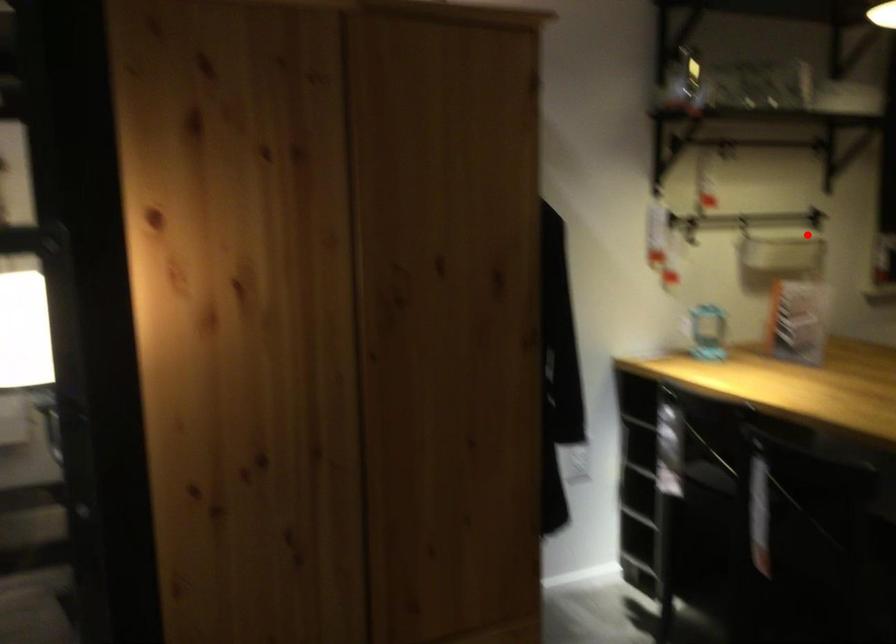
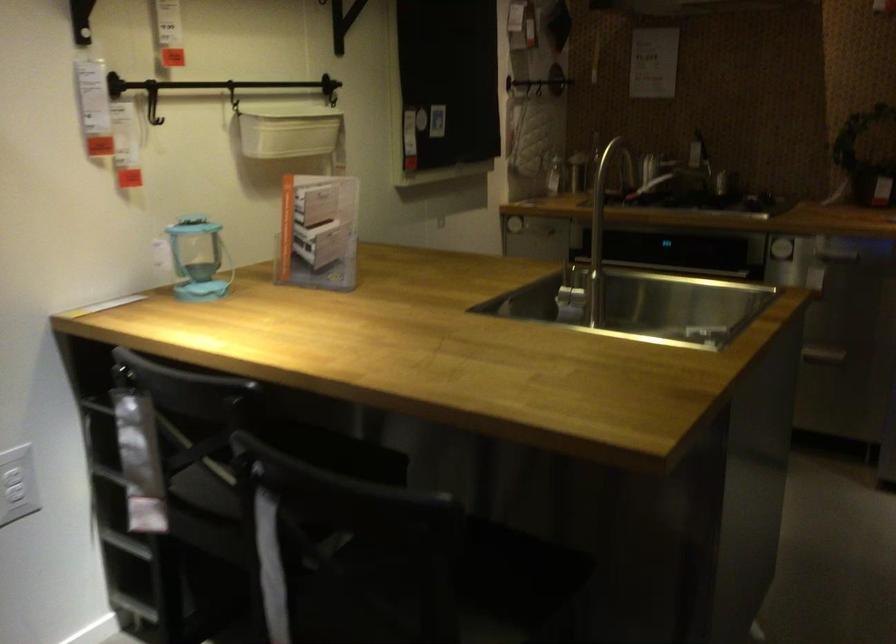
Question: I am providing you with two images of the same scene from different viewpoints. Image1 has a red point marked. In image2, the corresponding 3D location appears at what relative position? Reply with the corresponding letter.

Choices:
 (A) Closer
 (B) Farther

Answer: (A)